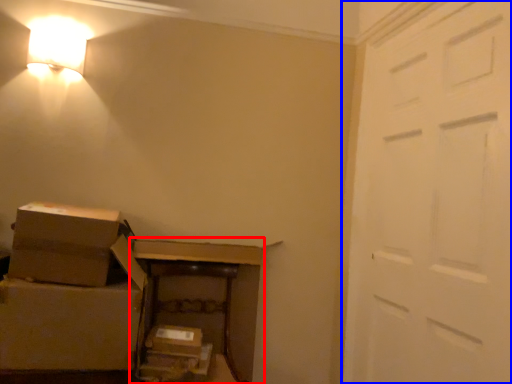
Question: Among these objects, which one is farthest to the camera, furniture (highlighted by a red box) or door (highlighted by a blue box)?

Choices:
 (A) furniture
 (B) door

Answer: (A)